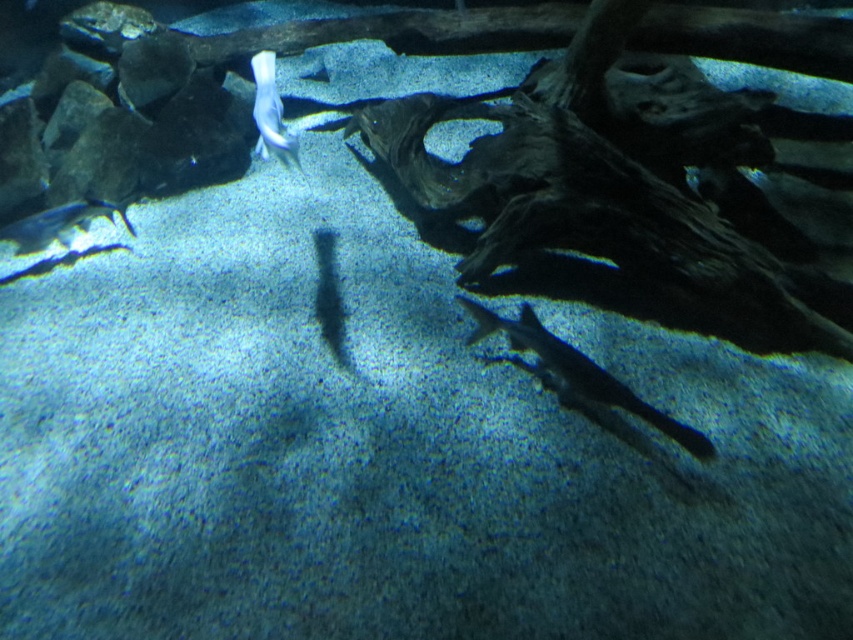
Consider the image. Can you confirm if translucent gray shark at lower right is positioned above shiny blue fish at left?

No.

Is translucent gray shark at lower right to the right of shiny blue fish at left from the viewer's perspective?

Indeed, translucent gray shark at lower right is positioned on the right side of shiny blue fish at left.

Locate an element on the screen. The image size is (853, 640). translucent gray shark at lower right is located at coordinates (579, 371).

How distant is translucent gray shark at lower right from white glossy fish at upper center?

translucent gray shark at lower right is 35.66 inches away from white glossy fish at upper center.

Between translucent gray shark at lower right and white glossy fish at upper center, which one has more height?

Standing taller between the two is translucent gray shark at lower right.

Is point (664, 420) closer to viewer compared to point (279, 124)?

No, it is not.

At what (x,y) coordinates should I click in order to perform the action: click on translucent gray shark at lower right. Please return your answer as a coordinate pair (x, y). Image resolution: width=853 pixels, height=640 pixels. Looking at the image, I should click on (579, 371).

Based on the photo, does shiny blue fish at left appear over white glossy fish at upper center?

Actually, shiny blue fish at left is below white glossy fish at upper center.

Who is shorter, shiny blue fish at left or white glossy fish at upper center?

shiny blue fish at left is shorter.

Locate an element on the screen. The image size is (853, 640). shiny blue fish at left is located at coordinates (59, 225).